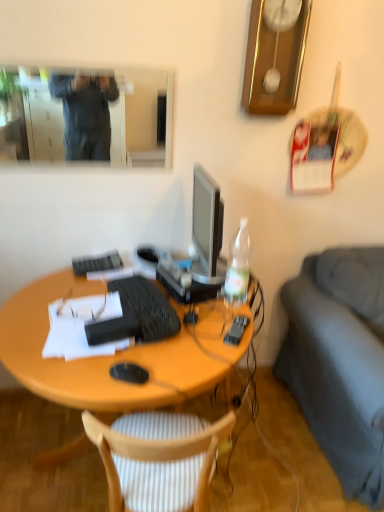
Question: From the image's perspective, does black plastic remote control at right appear higher than white paper at center?

Choices:
 (A) yes
 (B) no

Answer: (B)

Question: Is black plastic remote control at right taller than white paper at center?

Choices:
 (A) yes
 (B) no

Answer: (B)

Question: Can you confirm if black plastic remote control at right is positioned to the right of white paper at center?

Choices:
 (A) no
 (B) yes

Answer: (B)

Question: Can you confirm if black plastic remote control at right is positioned to the left of white paper at center?

Choices:
 (A) no
 (B) yes

Answer: (A)

Question: Is black plastic remote control at right thinner than white paper at center?

Choices:
 (A) no
 (B) yes

Answer: (B)

Question: Considering the positions of matte black glasses at center and clear plastic bottle at right in the image, is matte black glasses at center bigger or smaller than clear plastic bottle at right?

Choices:
 (A) small
 (B) big

Answer: (A)

Question: In terms of width, does matte black glasses at center look wider or thinner when compared to clear plastic bottle at right?

Choices:
 (A) thin
 (B) wide

Answer: (B)

Question: Which is correct: matte black glasses at center is inside clear plastic bottle at right, or outside of it?

Choices:
 (A) outside
 (B) inside

Answer: (A)

Question: Is point coord(71,312) closer or farther from the camera than point coord(231,302)?

Choices:
 (A) closer
 (B) farther

Answer: (A)

Question: Is wooden clock at upper center situated inside dark gray fabric couch at right or outside?

Choices:
 (A) outside
 (B) inside

Answer: (A)

Question: Is wooden clock at upper center wider or thinner than dark gray fabric couch at right?

Choices:
 (A) wide
 (B) thin

Answer: (B)

Question: From a real-world perspective, is wooden clock at upper center above or below dark gray fabric couch at right?

Choices:
 (A) below
 (B) above

Answer: (B)

Question: Considering the positions of wooden clock at upper center and dark gray fabric couch at right in the image, is wooden clock at upper center taller or shorter than dark gray fabric couch at right?

Choices:
 (A) short
 (B) tall

Answer: (A)

Question: Is black matte computer mouse at center wider or thinner than black plastic remote control at right?

Choices:
 (A) wide
 (B) thin

Answer: (B)

Question: Does point (134, 370) appear closer or farther from the camera than point (241, 316)?

Choices:
 (A) closer
 (B) farther

Answer: (A)